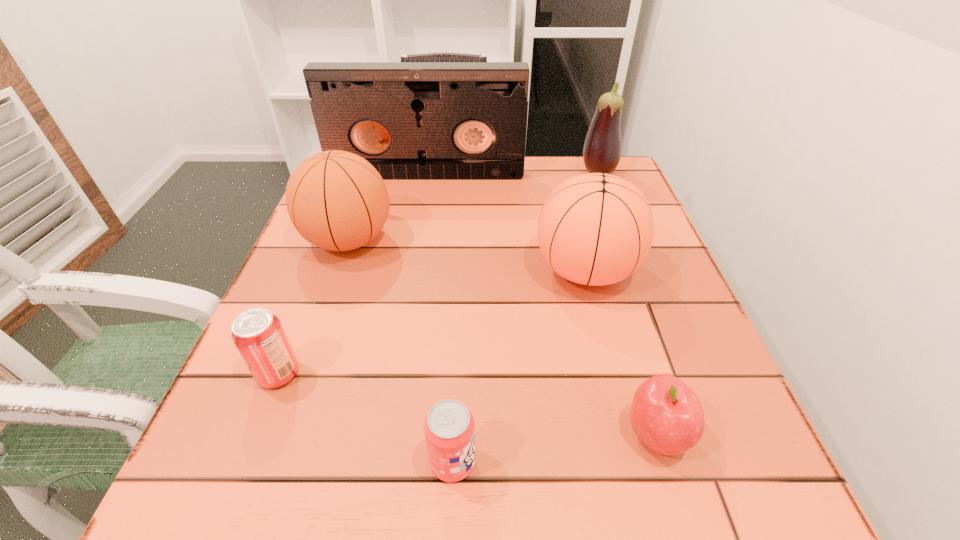
Where is `free space located 0.340m on the front of the right basketball`? The height and width of the screenshot is (540, 960). free space located 0.340m on the front of the right basketball is located at coordinates (646, 504).

The width and height of the screenshot is (960, 540). What are the coordinates of `vacant space situated 0.120m on the right of the left basketball` in the screenshot? It's located at (450, 240).

Where is `blank space located on the back of the farther soda can`? This screenshot has width=960, height=540. blank space located on the back of the farther soda can is located at coordinates (308, 301).

This screenshot has height=540, width=960. What are the coordinates of `free space located 0.290m on the surface of the nearer soda can` in the screenshot? It's located at (688, 462).

You are a GUI agent. You are given a task and a screenshot of the screen. Output one action in this format:
    pyautogui.click(x=<x>, y=<y>)
    Task: Click on the vacant space located on the back of the apple
    
    Given the screenshot: What is the action you would take?
    pyautogui.click(x=613, y=296)

Identify the location of videotape that is at the far edge. (410, 120).

This screenshot has width=960, height=540. Identify the location of eggplant at the far edge. (602, 148).

At what (x,y) coordinates should I click in order to perform the action: click on soda can positioned at the near edge. Please return your answer as a coordinate pair (x, y). This screenshot has height=540, width=960. Looking at the image, I should click on (449, 428).

Image resolution: width=960 pixels, height=540 pixels. Find the location of `apple located at the near edge`. apple located at the near edge is located at coordinates (666, 415).

Image resolution: width=960 pixels, height=540 pixels. In order to click on videotape located in the left edge section of the desktop in this screenshot , I will do `click(410, 120)`.